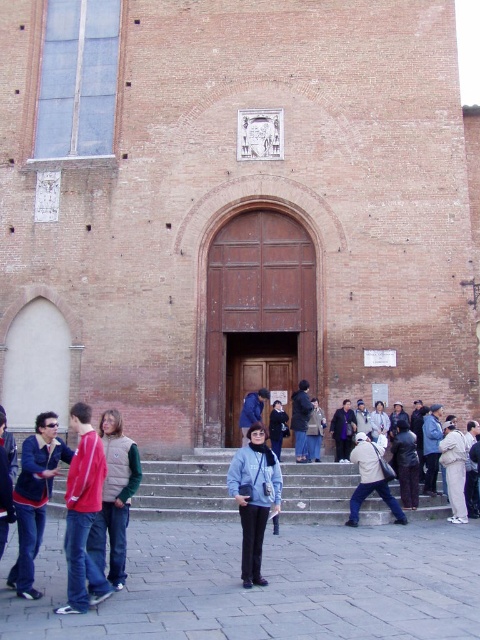
You are a tailor measuring garments for display in a store. You have a mannequin that can only accommodate items up to 40 cm in width. You need to decide which of the two garments, the green fleece vest at lower left or the dark blue fabric coat at center, can fit on the mannequin. Based on their widths, which one should you choose?

The green fleece vest at lower left might be wider than dark blue fabric coat at center. Since the mannequin can only accommodate up to 40 cm, the dark blue fabric coat at center is safer to choose as it is likely narrower than the vest.

You are a visitor standing in front of the historic building and see both the green fleece vest at lower left and the dark blue fabric coat at center. Which clothing item is positioned closer to the left side of the building?

The green fleece vest at lower left is positioned to the left of the dark blue fabric coat at center, so it is closer to the left side of the building.

You are a visitor approaching the historic building. You see the stone steps at center and the blue denim jacket at center. Which object is closer to the ground?

The stone steps at center are closer to the ground because they are positioned below the blue denim jacket at center.